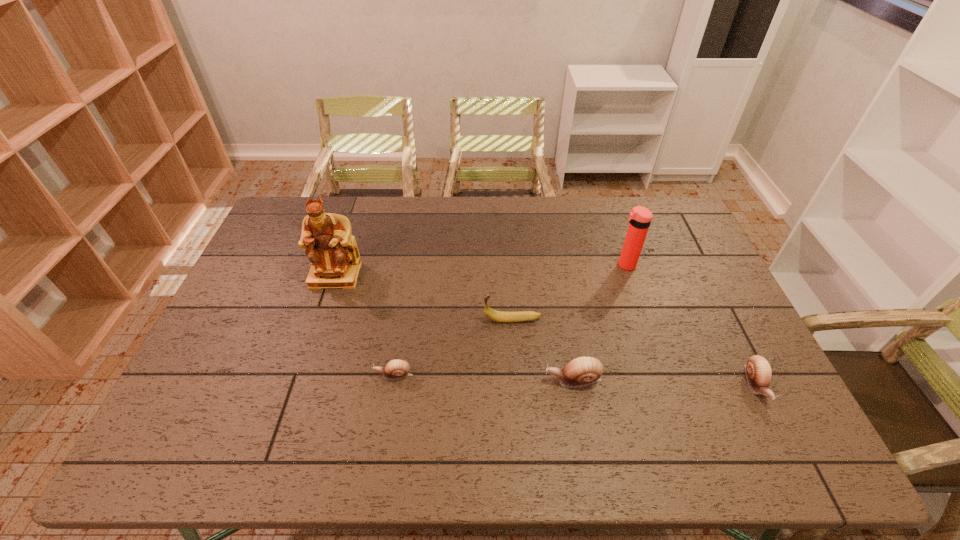
This screenshot has width=960, height=540. I want to click on the shortest object, so pos(395,369).

At what (x,y) coordinates should I click in order to perform the action: click on the leftmost escargot. Please return your answer as a coordinate pair (x, y). The width and height of the screenshot is (960, 540). Looking at the image, I should click on (395, 369).

I want to click on the third shortest object, so click(582, 371).

I want to click on the tallest escargot, so click(x=582, y=371).

Image resolution: width=960 pixels, height=540 pixels. Identify the location of the second tallest escargot. [758, 371].

I want to click on the fifth tallest object, so click(758, 371).

Find the location of a particular element. This screenshot has height=540, width=960. banana is located at coordinates pyautogui.click(x=498, y=316).

You are a GUI agent. You are given a task and a screenshot of the screen. Output one action in this format:
    pyautogui.click(x=<x>, y=<y>)
    Task: Click on the fifth object from left to right
    The height and width of the screenshot is (540, 960).
    Given the screenshot: What is the action you would take?
    pyautogui.click(x=640, y=217)

Locate an element on the screen. This screenshot has width=960, height=540. the fifth shortest object is located at coordinates (640, 217).

At what (x,y) coordinates should I click in order to perform the action: click on figurine. Please return your answer as a coordinate pair (x, y). This screenshot has width=960, height=540. Looking at the image, I should click on (335, 261).